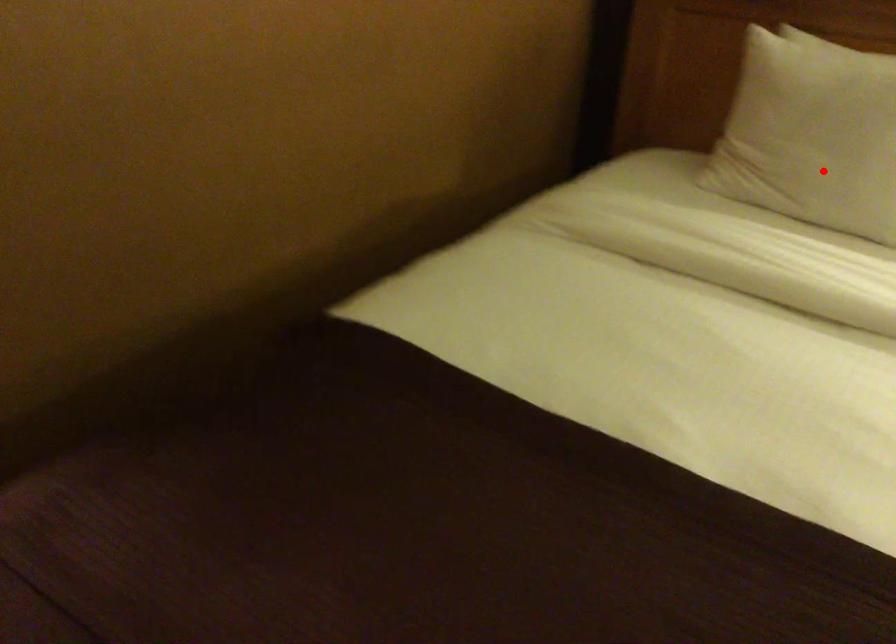
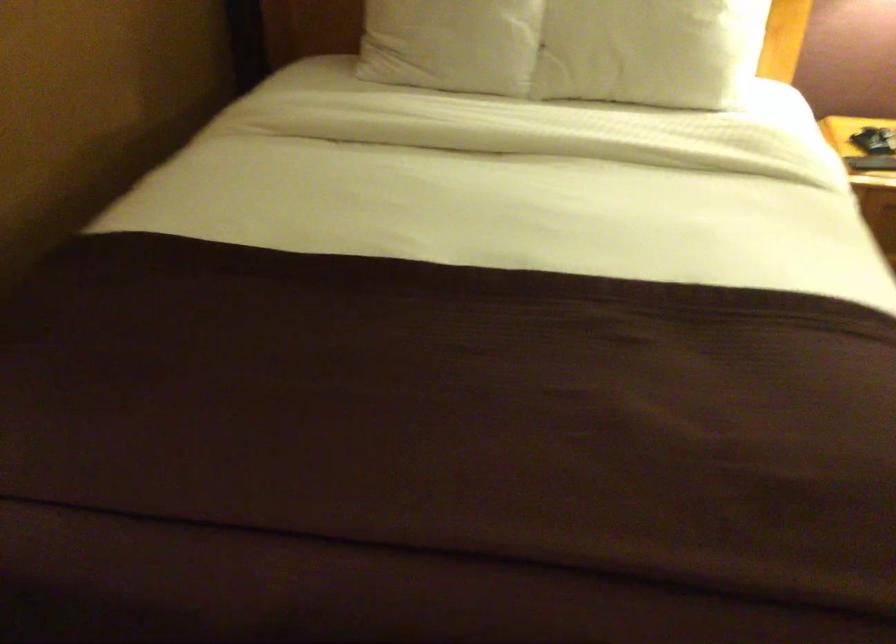
The point at the highlighted location is marked in the first image. Where is the corresponding point in the second image?

(452, 44)